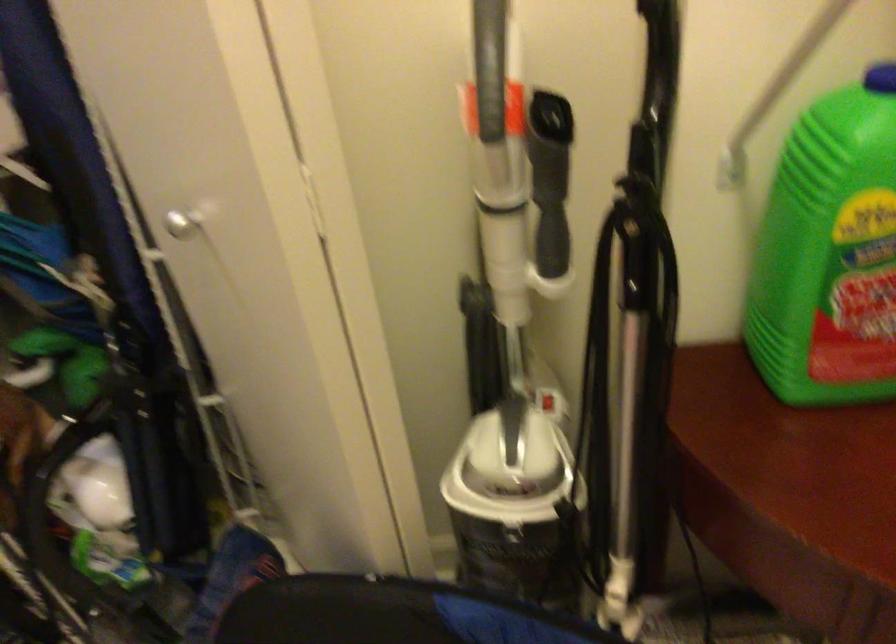
How did the camera likely rotate?

The rotation direction of the camera is right-up.